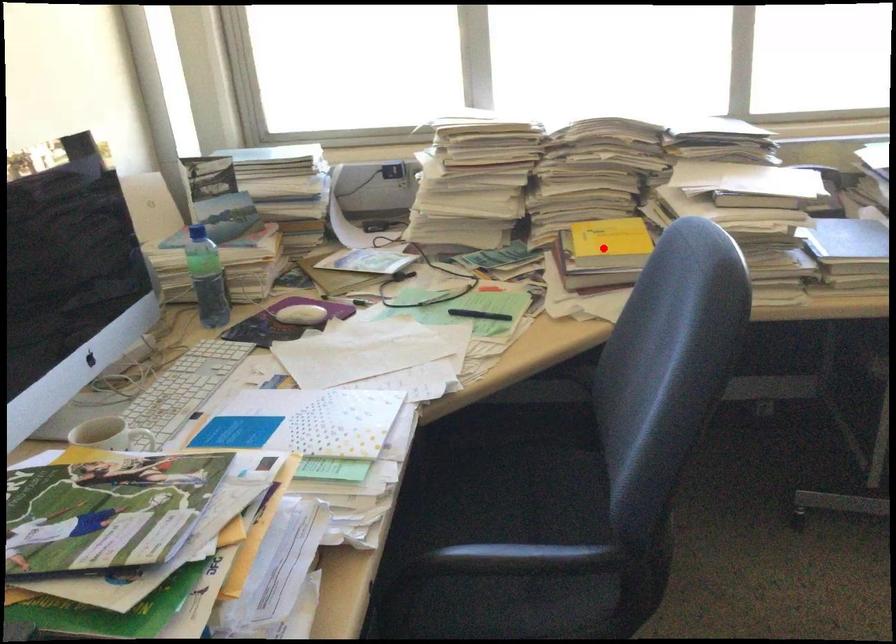
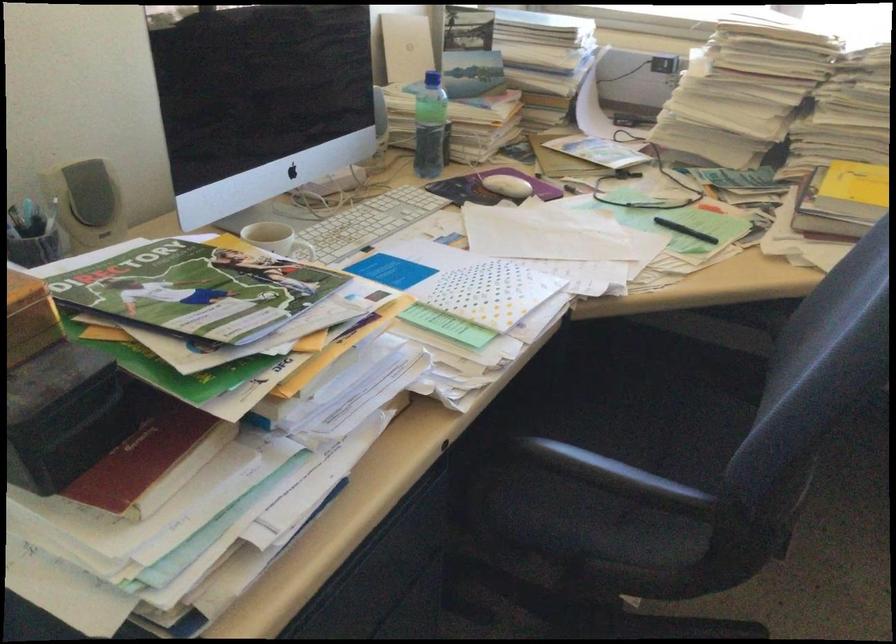
The point at the highlighted location is marked in the first image. Where is the corresponding point in the second image?

(853, 194)